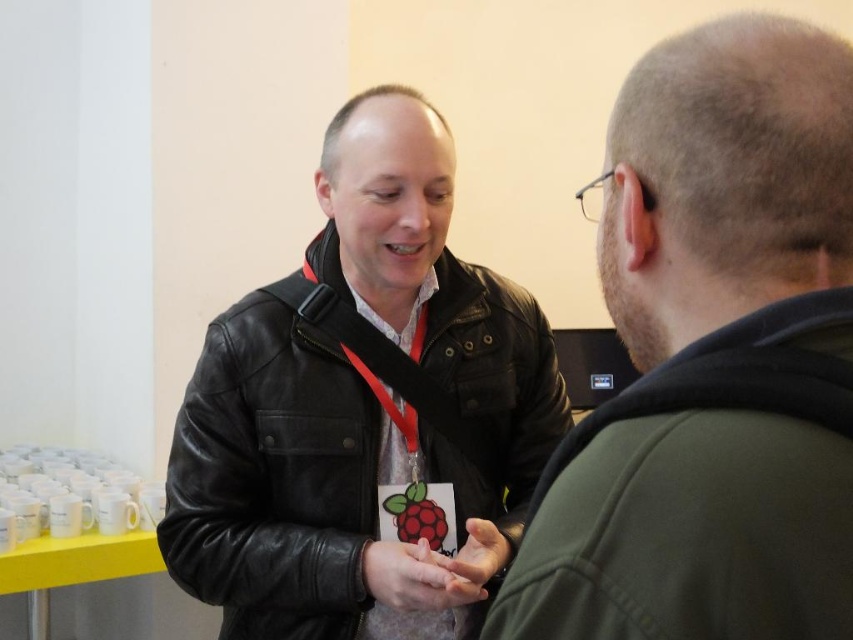
You are designing a seating arrangement for a meeting room. The black leather jacket at center and the white matte neck at center need to be seated such that there is enough space between them. Based on their sizes, which object requires more space to accommodate?

The black leather jacket at center requires more space because it is larger in size than the white matte neck at center.

You are standing at the entrance of the event venue and want to locate the black leather jacket at center. According to the coordinates provided, in which direction should you move from your current position to reach it?

The black leather jacket at center is located at coordinates point (273,477). Since the coordinate system is normalized, moving towards the right and slightly forward from the entrance would bring you closer to the black leather jacket at center.